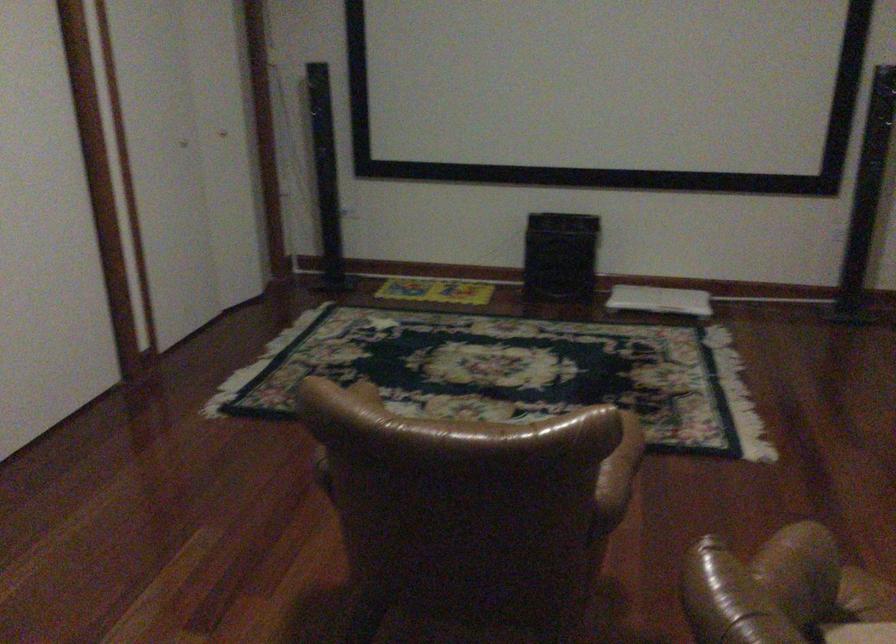
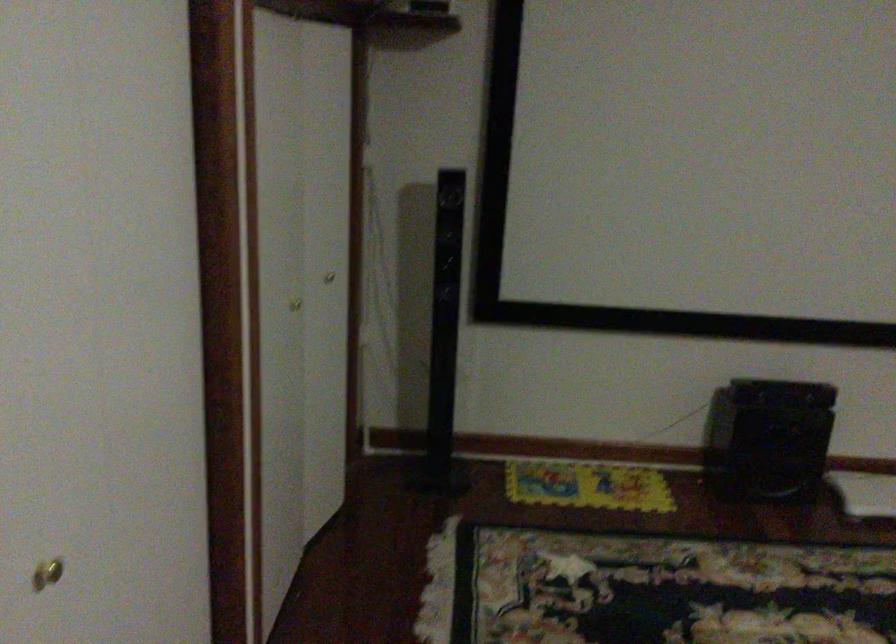
What movement of the cameraman would produce the second image?

The cameraman walked toward left, forward.